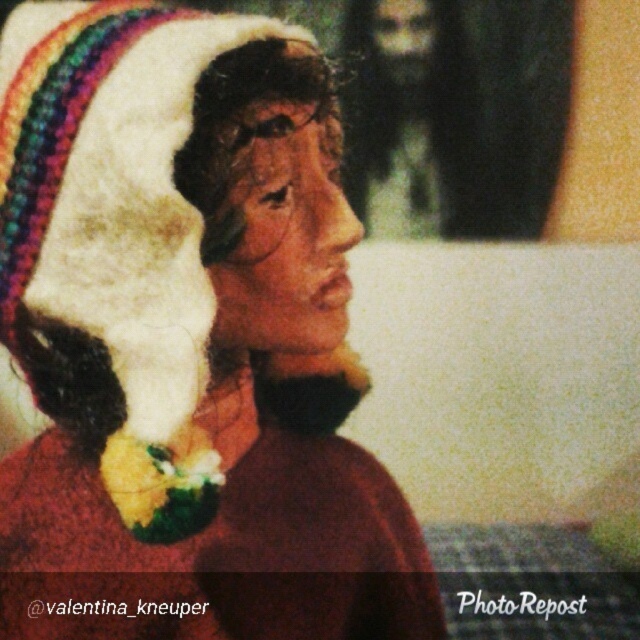
Can you confirm if white knitted hat at upper left is thinner than bearded man at upper center?

Yes.

Is white knitted hat at upper left taller than bearded man at upper center?

In fact, white knitted hat at upper left may be shorter than bearded man at upper center.

Image resolution: width=640 pixels, height=640 pixels. What do you see at coordinates (186, 339) in the screenshot?
I see `white knitted hat at upper left` at bounding box center [186, 339].

Locate an element on the screen. This screenshot has width=640, height=640. white knitted hat at upper left is located at coordinates (186, 339).

Is white knitted hat at upper left bigger than beige fabric head at upper center?

Yes.

Does point (77, 38) come behind point (403, 3)?

No, it is in front of (403, 3).

Locate an element on the screen. white knitted hat at upper left is located at coordinates (186, 339).

Is bearded man at upper center thinner than beige fabric head at upper center?

No.

Between point (355, 24) and point (380, 72), which one is positioned in front?

Point (355, 24) is more forward.

I want to click on bearded man at upper center, so click(442, 108).